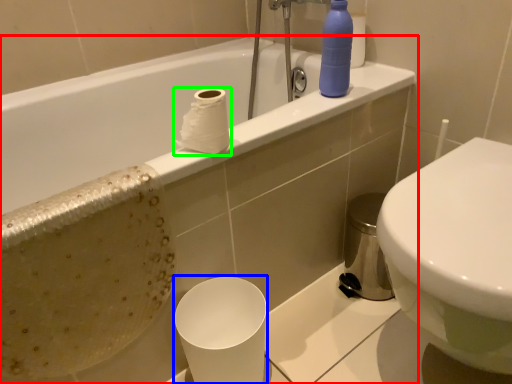
Question: Based on their relative distances, which object is nearer to bathtub (highlighted by a red box)? Choose from paper cup (highlighted by a blue box) and toilet paper (highlighted by a green box).

Choices:
 (A) paper cup
 (B) toilet paper

Answer: (A)